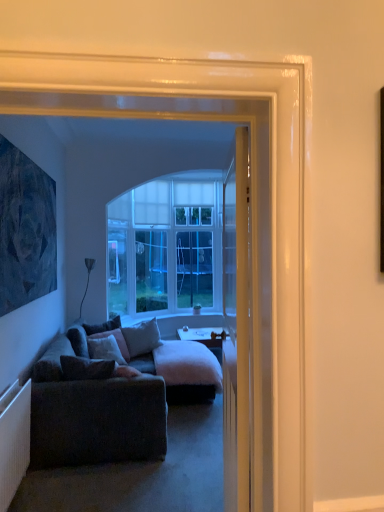
This screenshot has width=384, height=512. I want to click on vacant area on top of velvet gray pillow at center, the 2th pillow from the front (from a real-world perspective), so click(x=103, y=331).